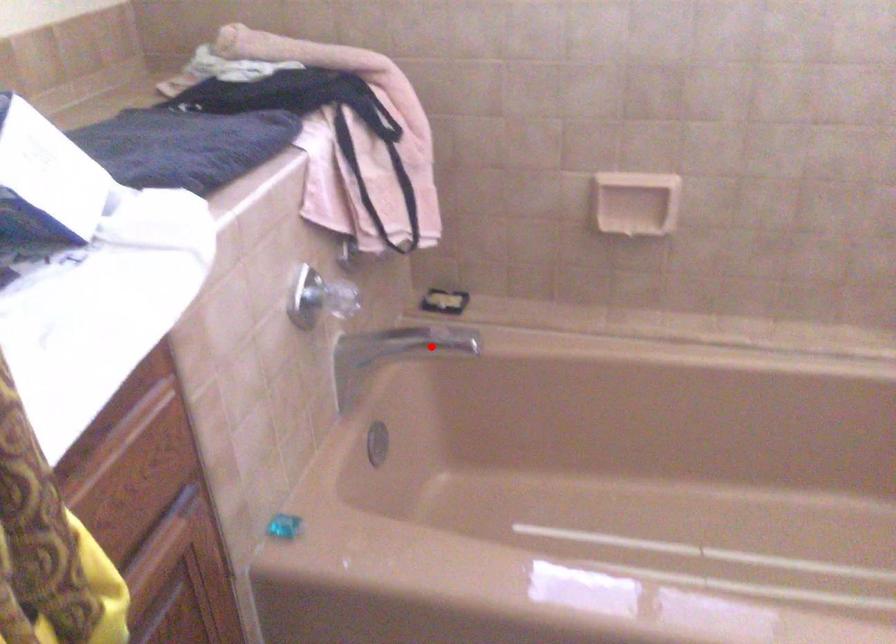
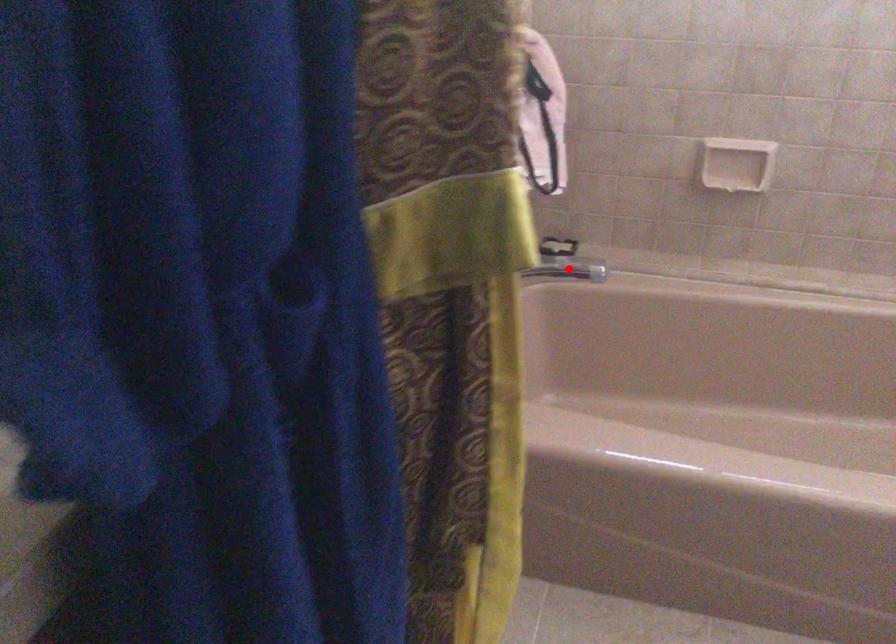
I am providing you with two images of the same scene from different viewpoints. A red point is marked on the first image and another point is marked on the second image. Are the points marked in image1 and image2 representing the same 3D position?

Yes